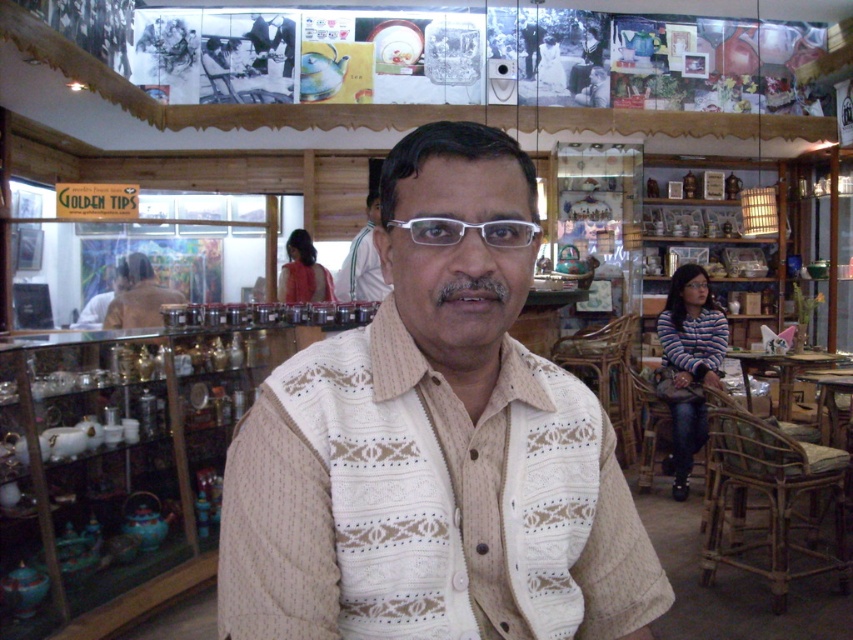
Is white knitted sweater at center wider than clear plastic glasses at center?

Correct, the width of white knitted sweater at center exceeds that of clear plastic glasses at center.

This screenshot has width=853, height=640. I want to click on white knitted sweater at center, so click(434, 449).

Is point (608, 538) in front of point (502, 230)?

That is False.

Locate an element on the screen. The image size is (853, 640). white knitted sweater at center is located at coordinates (434, 449).

Who is lower down, clear plastic glasses at center or white textured shirt at center?

clear plastic glasses at center

Based on the photo, which is above, clear plastic glasses at center or white textured shirt at center?

white textured shirt at center

Is point (456, 240) more distant than point (364, 259)?

No, (456, 240) is in front of (364, 259).

Image resolution: width=853 pixels, height=640 pixels. In order to click on clear plastic glasses at center in this screenshot , I will do `click(465, 230)`.

Between point (368, 595) and point (165, 298), which one is positioned in front?

Positioned in front is point (368, 595).

Who is lower down, white knitted sweater at center or brown fabric shirt at center?

white knitted sweater at center is below.

The width and height of the screenshot is (853, 640). In order to click on white knitted sweater at center in this screenshot , I will do click(x=434, y=449).